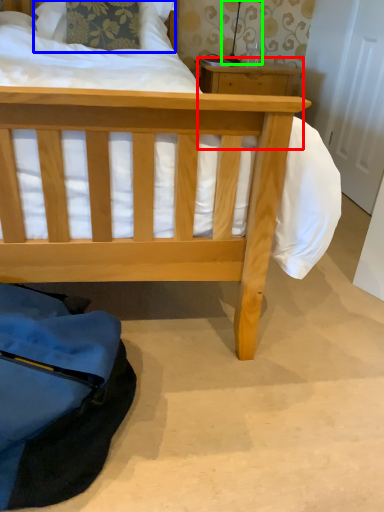
Question: Which object is the farthest from table (highlighted by a red box)? Choose among these: pillow (highlighted by a blue box) or table lamp (highlighted by a green box).

Choices:
 (A) pillow
 (B) table lamp

Answer: (A)